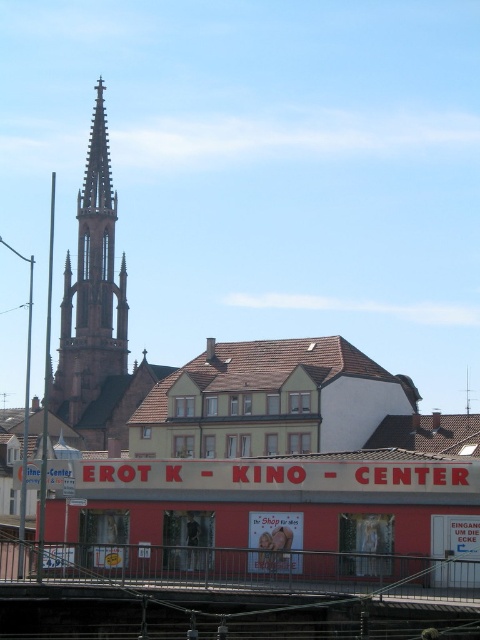
Between metallic gray train track at lower center and brown stone spire at left, which one is positioned lower?

metallic gray train track at lower center is lower down.

Is metallic gray train track at lower center wider than brown stone spire at left?

Correct, the width of metallic gray train track at lower center exceeds that of brown stone spire at left.

Which is in front, point (108, 596) or point (80, 262)?

Point (108, 596) is in front.

Identify the location of metallic gray train track at lower center. (220, 614).

Based on the photo, which is above, metallic gray train track at lower center or white glossy poster at center?

Positioned higher is white glossy poster at center.

Between point (441, 616) and point (250, 524), which one is positioned behind?

The point (250, 524) is more distant.

This screenshot has height=640, width=480. In order to click on metallic gray train track at lower center in this screenshot , I will do `click(220, 614)`.

Between point (78, 416) and point (282, 548), which one is positioned behind?

Positioned behind is point (78, 416).

Is brown stone spire at left below white glossy poster at center?

No.

The image size is (480, 640). Describe the element at coordinates (93, 300) in the screenshot. I see `brown stone spire at left` at that location.

You are a GUI agent. You are given a task and a screenshot of the screen. Output one action in this format:
    pyautogui.click(x=<x>, y=<y>)
    Task: Click on the brown stone spire at left
    This screenshot has height=640, width=480.
    Given the screenshot: What is the action you would take?
    pyautogui.click(x=93, y=300)